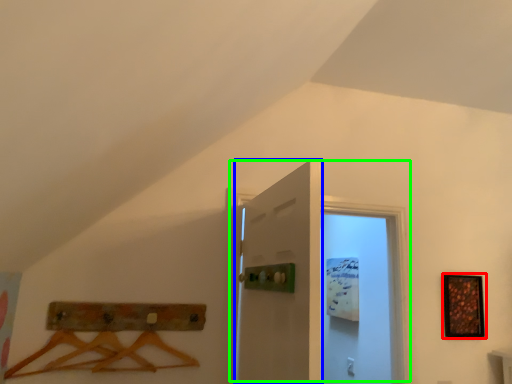
Question: Which is farther away from picture frame (highlighted by a red box)? door (highlighted by a blue box) or door (highlighted by a green box)?

Choices:
 (A) door
 (B) door

Answer: (A)